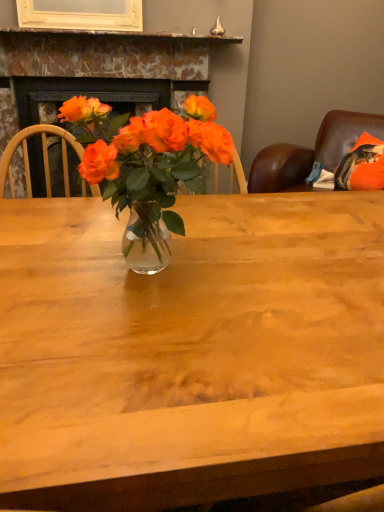
Question: From the image's perspective, would you say translucent glass vase at center is shown under marble fireplace at upper center?

Choices:
 (A) yes
 (B) no

Answer: (A)

Question: Does translucent glass vase at center have a greater width compared to marble fireplace at upper center?

Choices:
 (A) no
 (B) yes

Answer: (A)

Question: Is translucent glass vase at center not within marble fireplace at upper center?

Choices:
 (A) no
 (B) yes

Answer: (B)

Question: Is translucent glass vase at center at the left side of marble fireplace at upper center?

Choices:
 (A) yes
 (B) no

Answer: (B)

Question: Is translucent glass vase at center facing towards marble fireplace at upper center?

Choices:
 (A) no
 (B) yes

Answer: (A)

Question: Is translucent glass vase at center to the right of marble fireplace at upper center from the viewer's perspective?

Choices:
 (A) yes
 (B) no

Answer: (A)

Question: Does marble fireplace at upper center appear on the left side of translucent glass vase at center?

Choices:
 (A) no
 (B) yes

Answer: (B)

Question: Could you tell me if marble fireplace at upper center is facing translucent glass vase at center?

Choices:
 (A) yes
 (B) no

Answer: (A)

Question: Is marble fireplace at upper center closer to the viewer compared to translucent glass vase at center?

Choices:
 (A) yes
 (B) no

Answer: (B)

Question: Does marble fireplace at upper center have a larger size compared to translucent glass vase at center?

Choices:
 (A) no
 (B) yes

Answer: (B)

Question: Does marble fireplace at upper center appear on the right side of translucent glass vase at center?

Choices:
 (A) yes
 (B) no

Answer: (B)

Question: From a real-world perspective, is marble fireplace at upper center on top of translucent glass vase at center?

Choices:
 (A) no
 (B) yes

Answer: (A)

Question: From a real-world perspective, is marble fireplace at upper center positioned above or below translucent glass vase at center?

Choices:
 (A) below
 (B) above

Answer: (A)